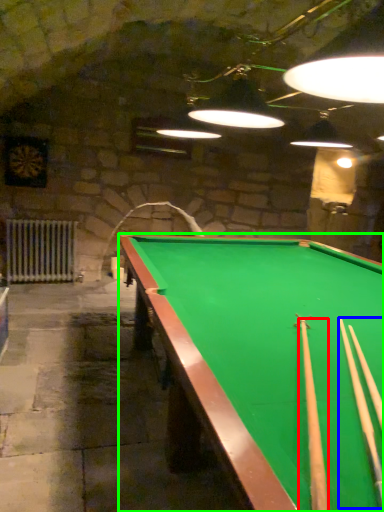
Question: Which object is positioned closest to cue (highlighted by a red box)? Select from cue (highlighted by a blue box) and billiard table (highlighted by a green box).

Choices:
 (A) cue
 (B) billiard table

Answer: (A)